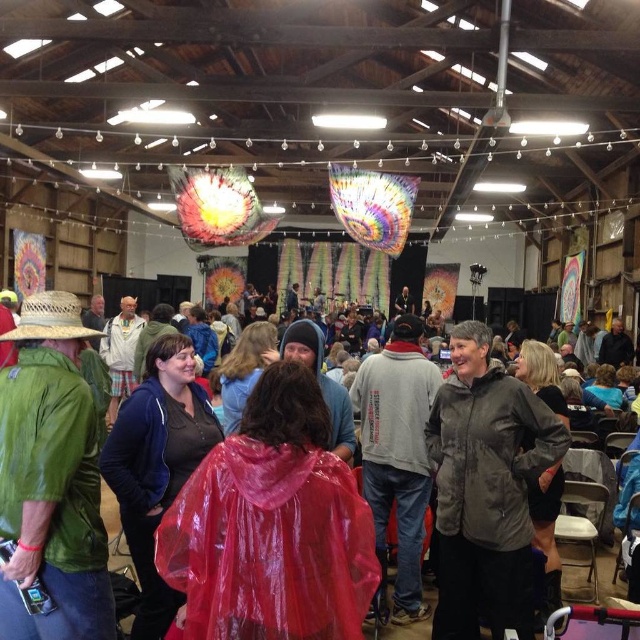
Question: Among these objects, which one is farthest from the camera?

Choices:
 (A) transparent plastic poncho at center
 (B) strawmaterial/texturehat at left
 (C) green leather jacket at left

Answer: (B)

Question: Which object is closer to the camera taking this photo?

Choices:
 (A) strawmaterial/texturehat at left
 (B) transparent plastic poncho at center

Answer: (B)

Question: Which object appears farthest from the camera in this image?

Choices:
 (A) green leather jacket at left
 (B) transparent plastic poncho at center
 (C) strawmaterial/texturehat at left

Answer: (C)

Question: Is green leather jacket at left positioned at the back of strawmaterial/texturehat at left?

Choices:
 (A) no
 (B) yes

Answer: (A)

Question: Is green leather jacket at left above strawmaterial/texturehat at left?

Choices:
 (A) no
 (B) yes

Answer: (A)

Question: Can you confirm if transparent plastic poncho at center is thinner than strawmaterial/texturehat at left?

Choices:
 (A) yes
 (B) no

Answer: (A)